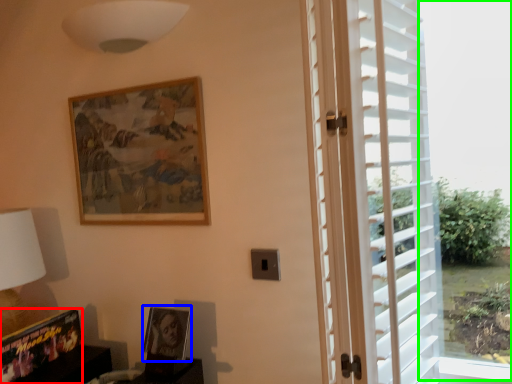
Question: Estimate the real-world distances between objects in this image. Which object is farther from picture frame (highlighted by a red box), picture frame (highlighted by a blue box) or window screen (highlighted by a green box)?

Choices:
 (A) picture frame
 (B) window screen

Answer: (B)